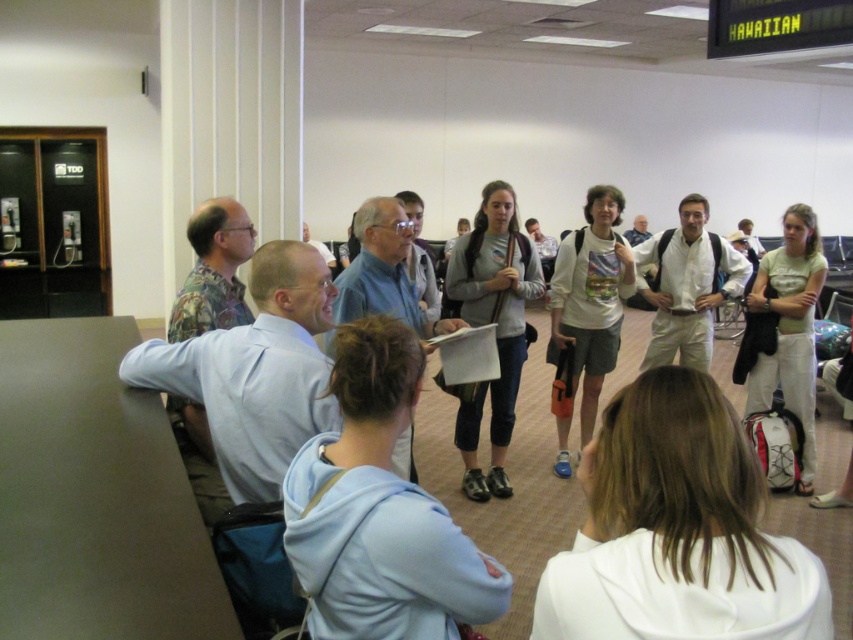
What are the coordinates of `white cotton hoodie at center` in the screenshot? It's located at (677, 529).

Who is higher up, white cotton hoodie at center or gray cotton hoodie at center?

Positioned higher is gray cotton hoodie at center.

Between point (640, 417) and point (477, 442), which one is positioned behind?

The point (477, 442) is behind.

I want to click on white cotton hoodie at center, so click(x=677, y=529).